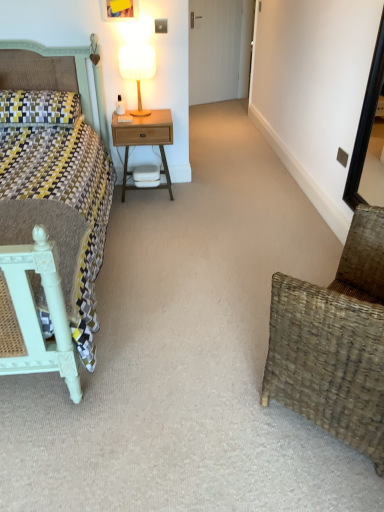
Question: Could yellow and gray woven pillow at left be considered to be inside matte green bed at left?

Choices:
 (A) no
 (B) yes

Answer: (B)

Question: Is matte green bed at left smaller than yellow and gray woven pillow at left?

Choices:
 (A) yes
 (B) no

Answer: (B)

Question: From a real-world perspective, is matte green bed at left positioned under yellow and gray woven pillow at left based on gravity?

Choices:
 (A) no
 (B) yes

Answer: (B)

Question: Considering the relative positions of matte green bed at left and yellow and gray woven pillow at left in the image provided, is matte green bed at left to the right of yellow and gray woven pillow at left from the viewer's perspective?

Choices:
 (A) no
 (B) yes

Answer: (B)

Question: Is matte green bed at left further to camera compared to yellow and gray woven pillow at left?

Choices:
 (A) no
 (B) yes

Answer: (A)

Question: Is point (147, 47) closer or farther from the camera than point (276, 368)?

Choices:
 (A) farther
 (B) closer

Answer: (A)

Question: Choose the correct answer: Is wooden table lamp at upper center inside woven brown chair at lower right or outside it?

Choices:
 (A) inside
 (B) outside

Answer: (B)

Question: From the image's perspective, is wooden table lamp at upper center located above or below woven brown chair at lower right?

Choices:
 (A) below
 (B) above

Answer: (B)

Question: In terms of size, does wooden table lamp at upper center appear bigger or smaller than woven brown chair at lower right?

Choices:
 (A) big
 (B) small

Answer: (B)

Question: From a real-world perspective, is yellow and gray woven pillow at left positioned above or below wooden table lamp at upper center?

Choices:
 (A) below
 (B) above

Answer: (A)

Question: Considering the positions of yellow and gray woven pillow at left and wooden table lamp at upper center in the image, is yellow and gray woven pillow at left bigger or smaller than wooden table lamp at upper center?

Choices:
 (A) big
 (B) small

Answer: (A)

Question: In the image, is yellow and gray woven pillow at left on the left side or the right side of wooden table lamp at upper center?

Choices:
 (A) right
 (B) left

Answer: (B)

Question: Is yellow and gray woven pillow at left wider or thinner than wooden table lamp at upper center?

Choices:
 (A) wide
 (B) thin

Answer: (A)

Question: From the image's perspective, relative to wooden table lamp at upper center, is matte green bed at left above or below?

Choices:
 (A) above
 (B) below

Answer: (B)

Question: Considering the positions of matte green bed at left and wooden table lamp at upper center in the image, is matte green bed at left wider or thinner than wooden table lamp at upper center?

Choices:
 (A) wide
 (B) thin

Answer: (A)